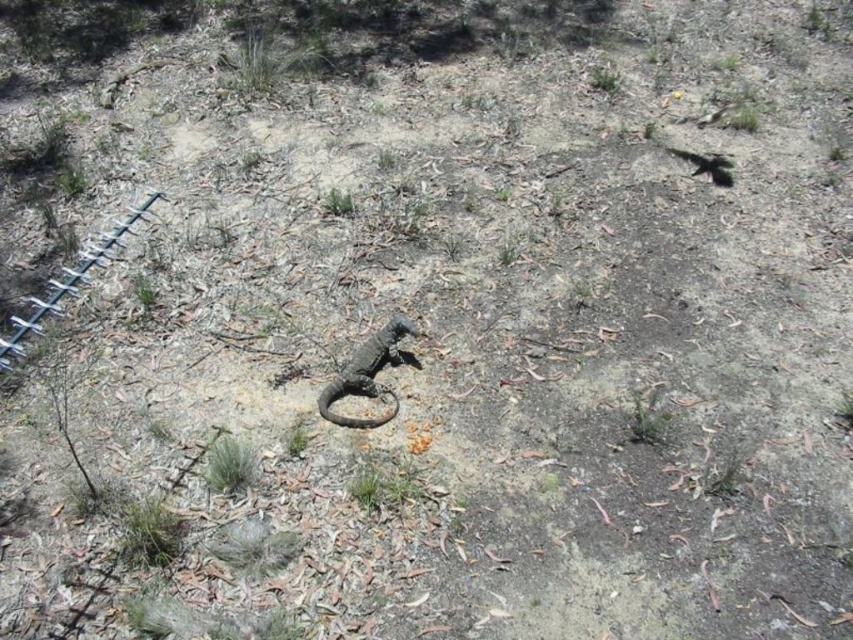
Which of these two, green grass at upper center or green leafy grass at center, stands shorter?

green leafy grass at center is shorter.

Is point (276, 61) positioned after point (334, 212)?

Yes, it is.

The image size is (853, 640). I want to click on green grass at upper center, so click(x=264, y=54).

Who is lower down, green grass at lower left or green leafy grass at center?

green grass at lower left is lower down.

Who is more distant from viewer, (231,472) or (339,211)?

Point (339,211)

Locate an element on the screen. This screenshot has height=640, width=853. green grass at lower left is located at coordinates (228, 464).

Measure the distance from dark brown scaly lizard at center to green leafy grass at center.

35.58 inches

Does dark brown scaly lizard at center have a greater height compared to green leafy grass at center?

Indeed, dark brown scaly lizard at center has a greater height compared to green leafy grass at center.

Locate an element on the screen. dark brown scaly lizard at center is located at coordinates (367, 372).